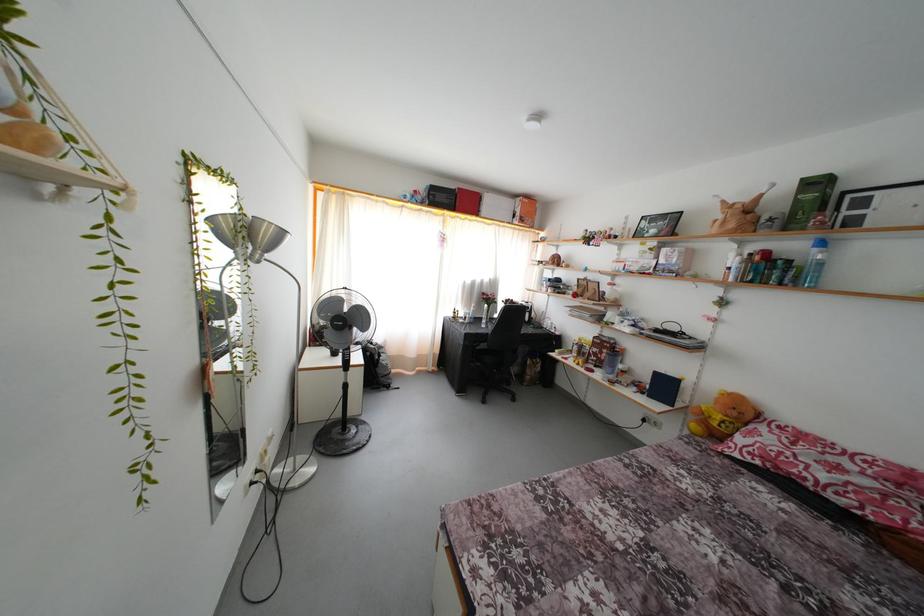
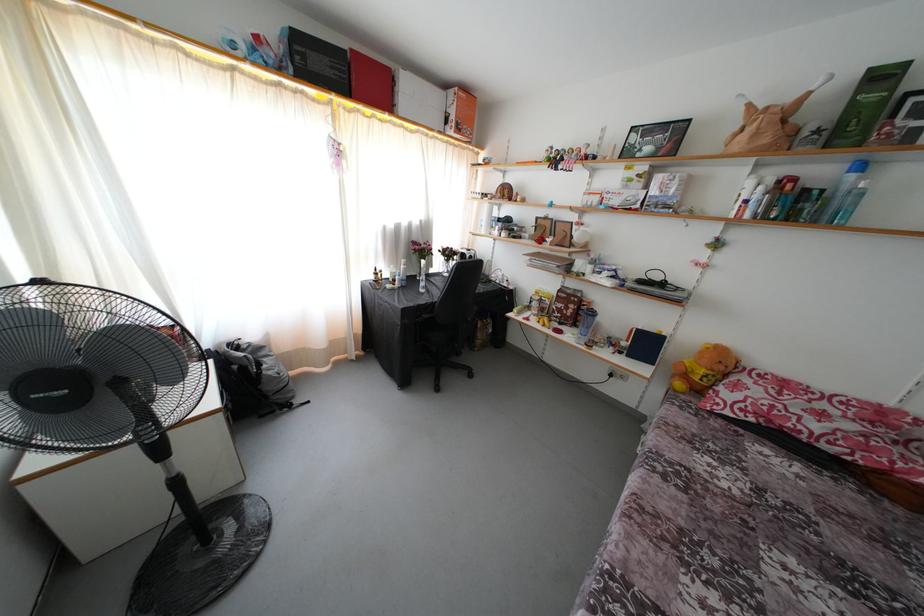
Question: Which direction would the cameraman need to move to produce the second image? Reply with the corresponding letter.

Choices:
 (A) Left
 (B) Right
 (C) Forward
 (D) Backward

Answer: (C)